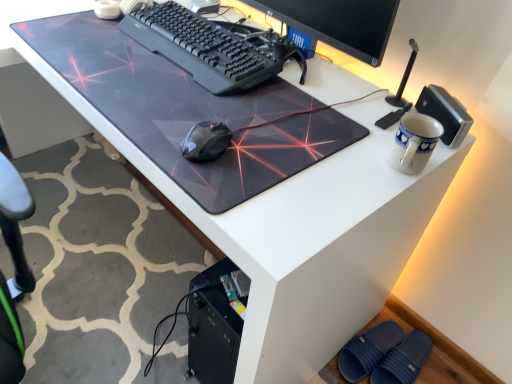
Question: Considering the relative positions of blue ceramic mug at upper right and black plastic keyboard at center in the image provided, is blue ceramic mug at upper right behind black plastic keyboard at center?

Choices:
 (A) yes
 (B) no

Answer: (B)

Question: From a real-world perspective, is blue ceramic mug at upper right positioned under black plastic keyboard at center based on gravity?

Choices:
 (A) no
 (B) yes

Answer: (A)

Question: Considering the relative sizes of blue ceramic mug at upper right and black plastic keyboard at center in the image provided, is blue ceramic mug at upper right smaller than black plastic keyboard at center?

Choices:
 (A) no
 (B) yes

Answer: (B)

Question: Does blue ceramic mug at upper right contain black plastic keyboard at center?

Choices:
 (A) no
 (B) yes

Answer: (A)

Question: Does blue ceramic mug at upper right have a lesser width compared to black plastic keyboard at center?

Choices:
 (A) yes
 (B) no

Answer: (A)

Question: Is blue ceramic mug at upper right not close to black plastic keyboard at center?

Choices:
 (A) no
 (B) yes

Answer: (A)

Question: Is blue textured slipper at lower right closer to camera compared to blue rubber slippers at lower right?

Choices:
 (A) no
 (B) yes

Answer: (B)

Question: Could blue rubber slippers at lower right be considered to be inside blue textured slipper at lower right?

Choices:
 (A) yes
 (B) no

Answer: (B)

Question: Considering the relative sizes of blue textured slipper at lower right and blue rubber slippers at lower right in the image provided, is blue textured slipper at lower right wider than blue rubber slippers at lower right?

Choices:
 (A) no
 (B) yes

Answer: (A)

Question: Is the surface of blue textured slipper at lower right in direct contact with blue rubber slippers at lower right?

Choices:
 (A) yes
 (B) no

Answer: (A)

Question: Is blue textured slipper at lower right bigger than blue rubber slippers at lower right?

Choices:
 (A) no
 (B) yes

Answer: (A)

Question: Is blue textured slipper at lower right positioned beyond the bounds of blue rubber slippers at lower right?

Choices:
 (A) no
 (B) yes

Answer: (B)

Question: Can you confirm if blue textured slipper at lower right is taller than transparent plastic mousepad at center?

Choices:
 (A) no
 (B) yes

Answer: (B)